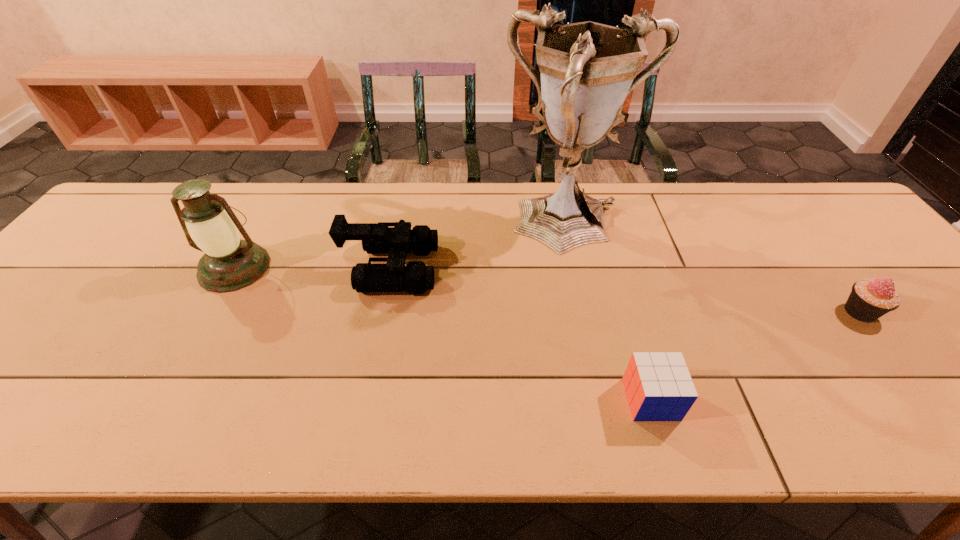
Find the location of a particular element. The width and height of the screenshot is (960, 540). vacant space located 0.080m with the light compartment facing forward on the leftmost object is located at coordinates (206, 319).

The image size is (960, 540). What are the coordinates of `vacant space situated 0.130m on the front lenses of the binoculars` in the screenshot? It's located at 486,268.

What are the coordinates of `free region located 0.050m on the left of the fourth tallest object` in the screenshot? It's located at (820, 312).

Locate an element on the screen. Image resolution: width=960 pixels, height=540 pixels. vacant region located 0.290m on the left of the nearest object is located at coordinates (484, 399).

Find the location of `object at the far edge`. object at the far edge is located at coordinates (588, 69).

Locate an element on the screen. This screenshot has height=540, width=960. object that is at the near edge is located at coordinates (658, 385).

The width and height of the screenshot is (960, 540). I want to click on object located in the right edge section of the desktop, so click(x=869, y=300).

The image size is (960, 540). I want to click on vacant space at the far edge of the desktop, so click(460, 215).

In the image, there is a desktop. Find the location of `vacant area at the near edge`. vacant area at the near edge is located at coordinates (502, 441).

In the image, there is a desktop. Identify the location of vacant region at the left edge. (56, 346).